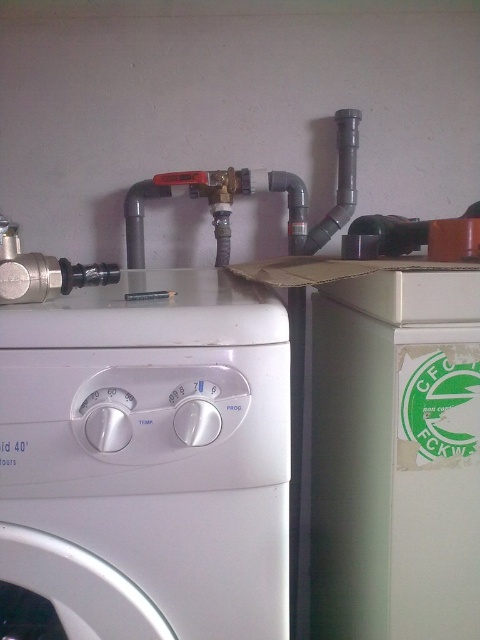
Question: Observing the image, what is the correct spatial positioning of white plastic washing machine at center in reference to gray matte pipe at upper center?

Choices:
 (A) left
 (B) right

Answer: (A)

Question: Does white plastic washing machine at center appear over gray matte pipe at upper center?

Choices:
 (A) yes
 (B) no

Answer: (B)

Question: Does white plastic washing machine at center have a lesser width compared to gray matte pipe at upper center?

Choices:
 (A) no
 (B) yes

Answer: (B)

Question: Among these points, which one is farthest from the camera?

Choices:
 (A) coord(123,540)
 (B) coord(263,176)

Answer: (B)

Question: Among these objects, which one is nearest to the camera?

Choices:
 (A) white plastic washing machine at center
 (B) gray matte pipe at upper center

Answer: (A)